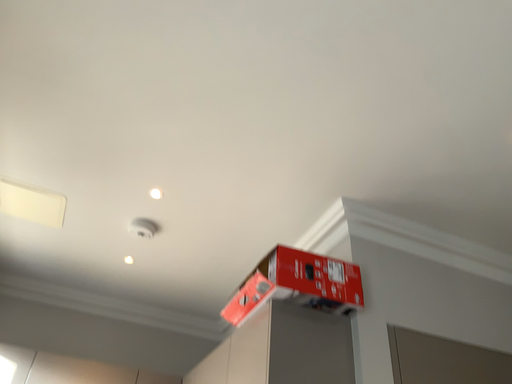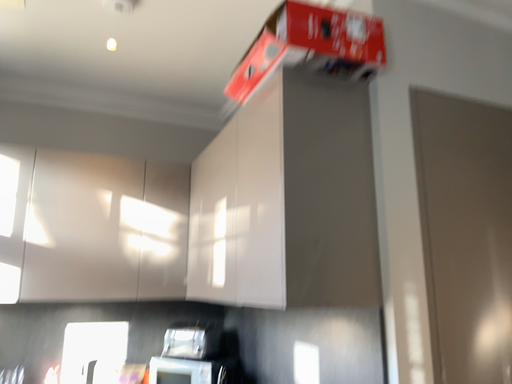
Question: Which way did the camera rotate in the video?

Choices:
 (A) rotated upward
 (B) rotated downward

Answer: (B)